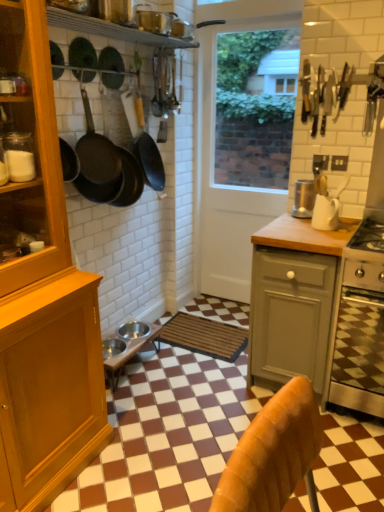
Question: From a real-world perspective, relative to wooden cabinet at left, is black matte frying pan at upper center, the 3th frying pan from the front, vertically above or below?

Choices:
 (A) below
 (B) above

Answer: (B)

Question: Is black matte frying pan at upper center, the 3th frying pan from the front, inside the boundaries of wooden cabinet at left, or outside?

Choices:
 (A) outside
 (B) inside

Answer: (A)

Question: Estimate the real-world distances between objects in this image. Which object is closer to the satin silver blender at center, marked as the 2th kitchen appliance in a front-to-back arrangement?

Choices:
 (A) wooden at right
 (B) white glossy door at center
 (C) wooden cabinet at left
 (D) white matte mug at upper right, the 2th kitchen appliance positioned from the back
 (E) matte black frying pan at upper left, the 2th frying pan when ordered from front to back

Answer: (D)

Question: Based on their relative distances, which object is farther from the wooden at right?

Choices:
 (A) wooden cabinet at left
 (B) black matte frying pan at upper left, arranged as the 1th frying pan when viewed from the front
 (C) metallic silver bowls at center
 (D) white matte mug at upper right, the 2th kitchen appliance positioned from the back
 (E) brown woven mat at center

Answer: (B)